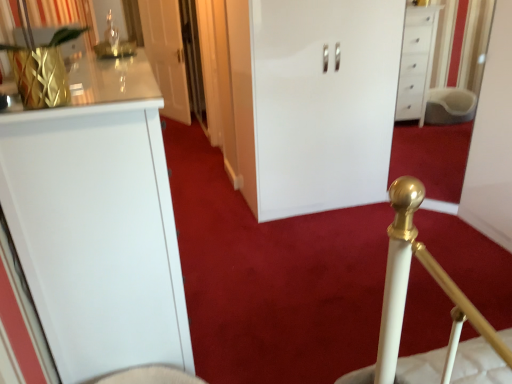
Question: Is white glossy door at upper center, the 2th door in the right-to-left sequence, turned away from gold metallic curtain at upper left?

Choices:
 (A) no
 (B) yes

Answer: (A)

Question: Is gold metallic curtain at upper left completely or partially inside white glossy door at upper center, which is the first door in back-to-front order?

Choices:
 (A) yes
 (B) no

Answer: (B)

Question: From the image's perspective, would you say white glossy door at upper center, which is the first door in back-to-front order, is shown under gold metallic curtain at upper left?

Choices:
 (A) no
 (B) yes

Answer: (A)

Question: Is white glossy door at upper center, the 2th door positioned from the front, thinner than gold metallic curtain at upper left?

Choices:
 (A) no
 (B) yes

Answer: (B)

Question: Is white glossy door at upper center, the 2th door positioned from the front, in front of gold metallic curtain at upper left?

Choices:
 (A) no
 (B) yes

Answer: (A)

Question: From a real-world perspective, does white glossy door at upper center, which appears as the first door when viewed from the left, stand above gold metallic curtain at upper left?

Choices:
 (A) yes
 (B) no

Answer: (B)

Question: Are white glossy cabinet at center, arranged as the 2th door when viewed from the back, and gold metallic curtain at upper left beside each other?

Choices:
 (A) no
 (B) yes

Answer: (A)

Question: Is white glossy cabinet at center, which ranks as the 2th door in left-to-right order, at the left side of gold metallic curtain at upper left?

Choices:
 (A) no
 (B) yes

Answer: (A)

Question: Would you say gold metallic curtain at upper left is part of white glossy cabinet at center, which is counted as the first door, starting from the right,'s contents?

Choices:
 (A) no
 (B) yes

Answer: (A)

Question: Could you tell me if white glossy cabinet at center, which is counted as the first door, starting from the right, is facing gold metallic curtain at upper left?

Choices:
 (A) yes
 (B) no

Answer: (B)

Question: Is white glossy cabinet at center, arranged as the 2th door when viewed from the back, at the right side of gold metallic curtain at upper left?

Choices:
 (A) no
 (B) yes

Answer: (B)

Question: From the image's perspective, does white glossy cabinet at center, which appears as the first door when viewed from the front, appear higher than gold metallic curtain at upper left?

Choices:
 (A) yes
 (B) no

Answer: (A)

Question: Is gold metallic curtain at upper left aimed at white glossy door at upper center, the 2th door in the right-to-left sequence?

Choices:
 (A) yes
 (B) no

Answer: (B)